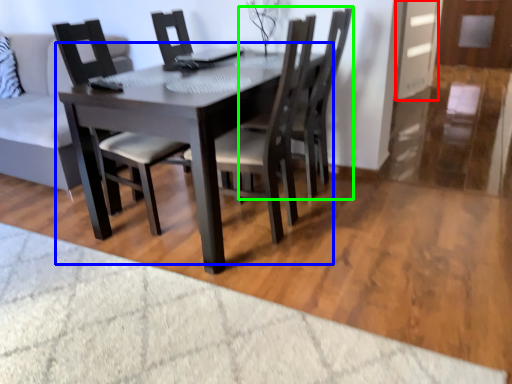
Question: Which object is positioned closest to glass door (highlighted by a red box)? Select from kitchen & dining room table (highlighted by a blue box) and chair (highlighted by a green box).

Choices:
 (A) kitchen & dining room table
 (B) chair

Answer: (B)